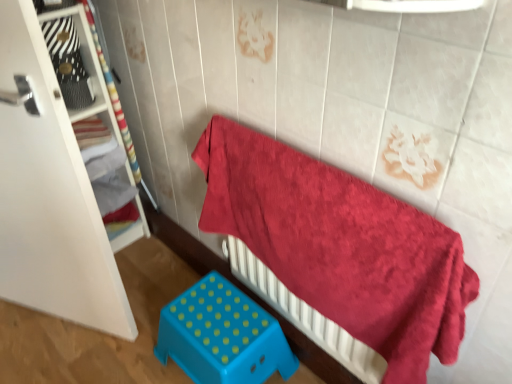
Question: From the image's perspective, would you say fluffy red towel at upper right is shown under white wood shelf at left?

Choices:
 (A) no
 (B) yes

Answer: (B)

Question: Does fluffy red towel at upper right have a lesser height compared to white wood shelf at left?

Choices:
 (A) yes
 (B) no

Answer: (A)

Question: Is fluffy red towel at upper right looking in the opposite direction of white wood shelf at left?

Choices:
 (A) yes
 (B) no

Answer: (B)

Question: Can you confirm if fluffy red towel at upper right is smaller than white wood shelf at left?

Choices:
 (A) yes
 (B) no

Answer: (A)

Question: Is there a large distance between fluffy red towel at upper right and white wood shelf at left?

Choices:
 (A) no
 (B) yes

Answer: (A)

Question: Does fluffy red towel at upper right have a greater width compared to white wood shelf at left?

Choices:
 (A) no
 (B) yes

Answer: (A)

Question: From a real-world perspective, is white wood shelf at left physically above blue plastic stool at lower center?

Choices:
 (A) yes
 (B) no

Answer: (A)

Question: Would you say white wood shelf at left is outside blue plastic stool at lower center?

Choices:
 (A) no
 (B) yes

Answer: (B)

Question: Considering the relative sizes of white wood shelf at left and blue plastic stool at lower center in the image provided, is white wood shelf at left shorter than blue plastic stool at lower center?

Choices:
 (A) no
 (B) yes

Answer: (A)

Question: Does white wood shelf at left have a greater width compared to blue plastic stool at lower center?

Choices:
 (A) no
 (B) yes

Answer: (B)

Question: Is white wood shelf at left in contact with blue plastic stool at lower center?

Choices:
 (A) no
 (B) yes

Answer: (A)

Question: Could you tell me if white wood shelf at left is turned towards blue plastic stool at lower center?

Choices:
 (A) no
 (B) yes

Answer: (A)

Question: Considering the relative positions of blue plastic stool at lower center and fluffy red towel at upper right in the image provided, is blue plastic stool at lower center in front of fluffy red towel at upper right?

Choices:
 (A) yes
 (B) no

Answer: (B)